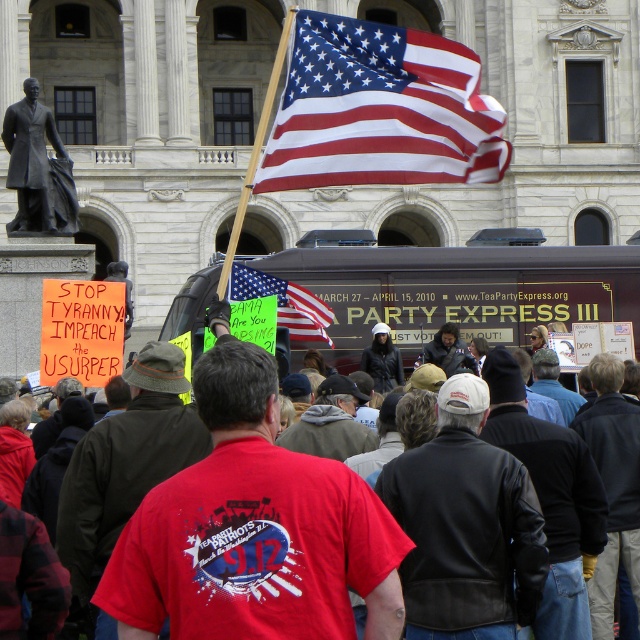
Question: Does brown wooden food truck at center have a greater width compared to american flag at center?

Choices:
 (A) yes
 (B) no

Answer: (A)

Question: Can you confirm if red cotton shirt at center is positioned above bronze statue at left?

Choices:
 (A) no
 (B) yes

Answer: (A)

Question: Which is nearer to the red t-shirt at center?

Choices:
 (A) brown wooden food truck at center
 (B) american flag at center

Answer: (A)

Question: Among these objects, which one is farthest from the camera?

Choices:
 (A) american flag at upper center
 (B) brown wooden food truck at center
 (C) bronze statue at left

Answer: (C)

Question: In this image, where is american flag at upper center located relative to brown wooden food truck at center?

Choices:
 (A) left
 (B) right

Answer: (A)

Question: Which object is the farthest from the bronze statue at left?

Choices:
 (A) american flag at upper center
 (B) red cotton shirt at center

Answer: (B)